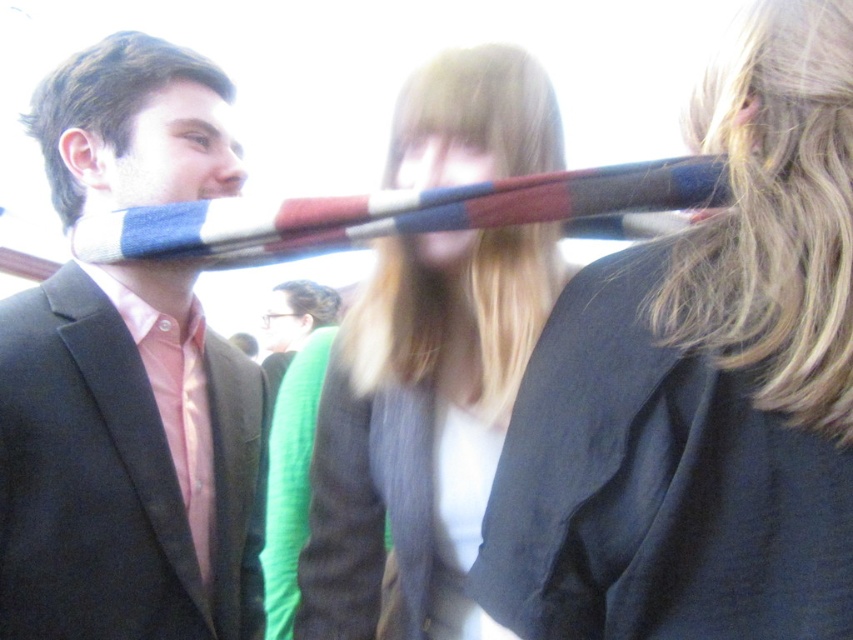
You are a photographer trying to adjust the lighting for a photo shoot. You notice the green knit sweater at center and the satin pink tie at left in the frame. Based on their positions, which object is closer to the left edge of the image?

The green knit sweater at center is to the left of the satin pink tie at left, so the green knit sweater at center is closer to the left edge of the image.